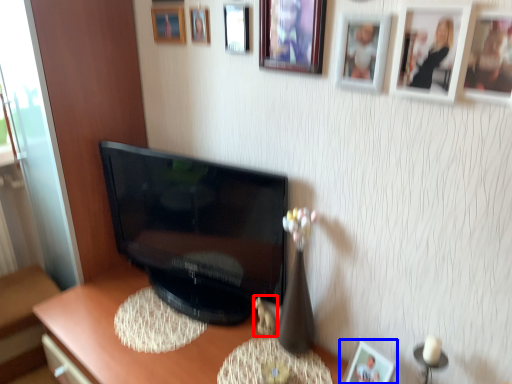
Question: Which object appears farthest to the camera in this image, toy (highlighted by a red box) or picture frame (highlighted by a blue box)?

Choices:
 (A) toy
 (B) picture frame

Answer: (A)